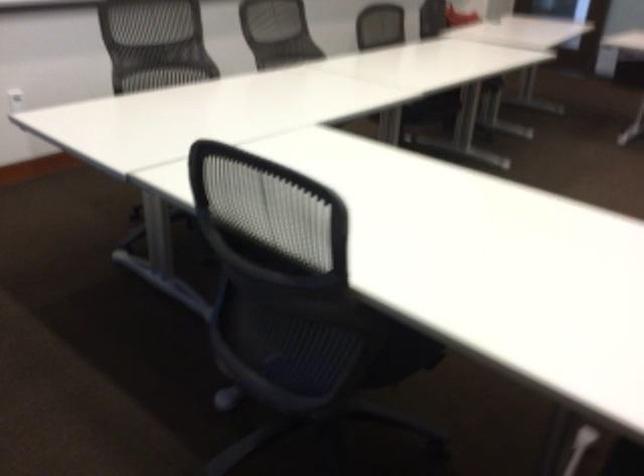
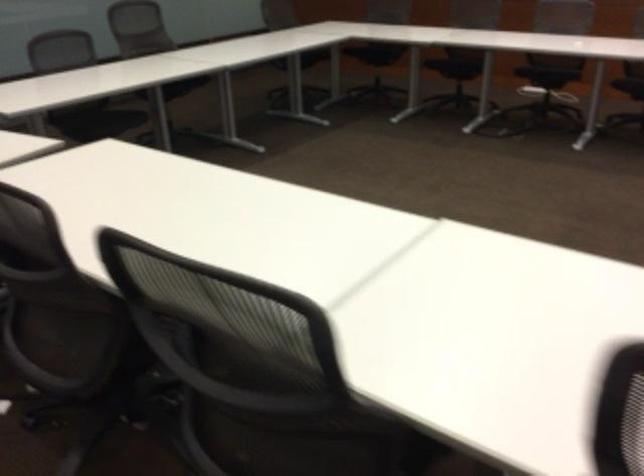
Question: In a continuous first-person perspective shot, in which direction is the camera moving?

Choices:
 (A) Left
 (B) Right
 (C) Forward
 (D) Backward

Answer: (D)